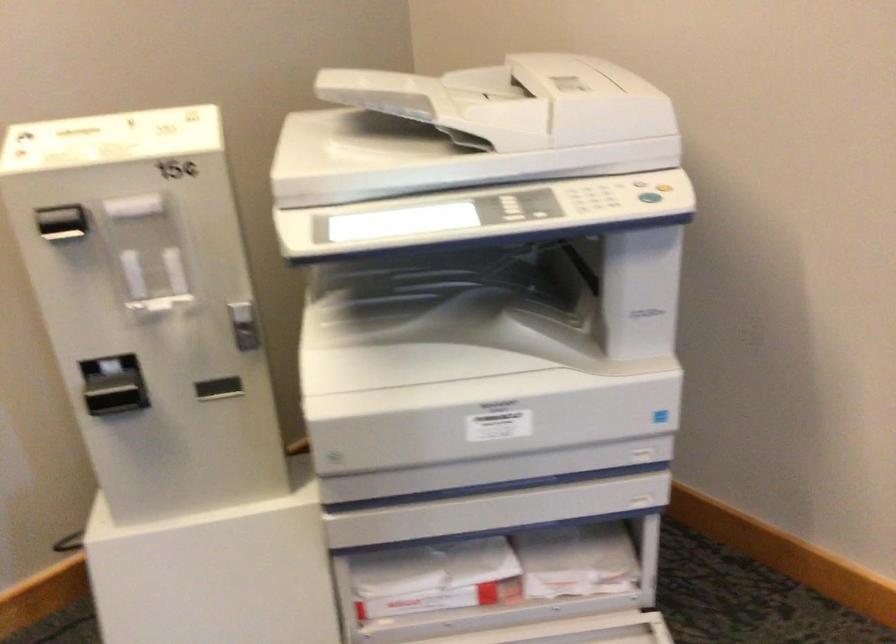
The height and width of the screenshot is (644, 896). What are the coordinates of `scanner lid` in the screenshot? It's located at (470, 129).